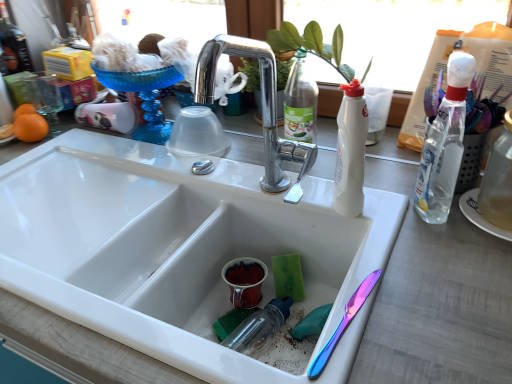
In order to click on vacant space behind white matte bottle at center, which appears as the 1th bottle when viewed from the left in this screenshot , I will do `click(322, 174)`.